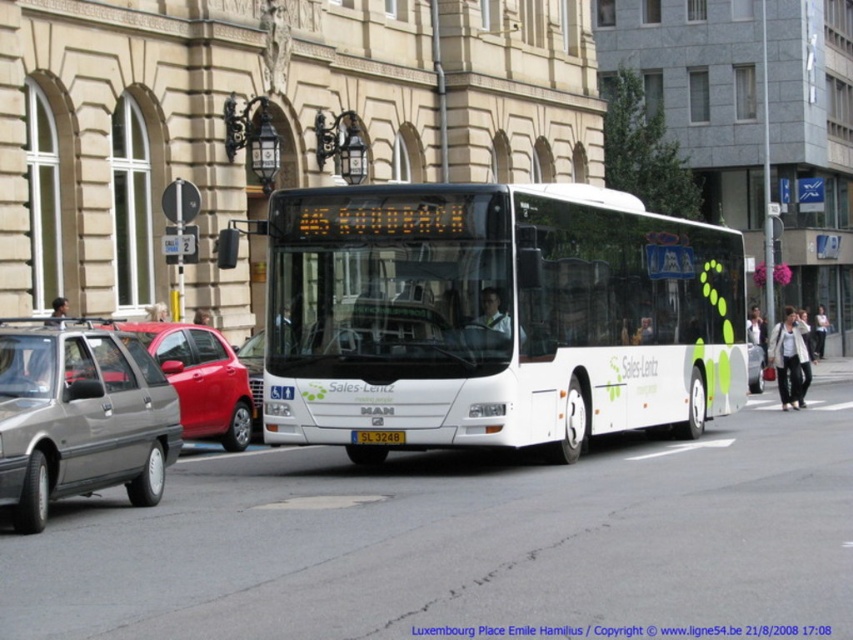
Question: Can you confirm if white glossy bus at center is smaller than yellow matte license plate at center?

Choices:
 (A) no
 (B) yes

Answer: (A)

Question: Which is nearer to the matte gray hatchback at left?

Choices:
 (A) white glossy bus at center
 (B) yellow matte license plate at center

Answer: (B)

Question: Which point is closer to the camera?

Choices:
 (A) coord(404,433)
 (B) coord(422,291)

Answer: (A)

Question: Can you confirm if white glossy bus at center is positioned above metallic gray sedan at left?

Choices:
 (A) yes
 (B) no

Answer: (A)

Question: Which object is the closest to the yellow matte license plate at center?

Choices:
 (A) white glossy bus at center
 (B) matte gray hatchback at left

Answer: (A)

Question: Does white glossy bus at center appear on the right side of matte gray hatchback at left?

Choices:
 (A) yes
 (B) no

Answer: (A)